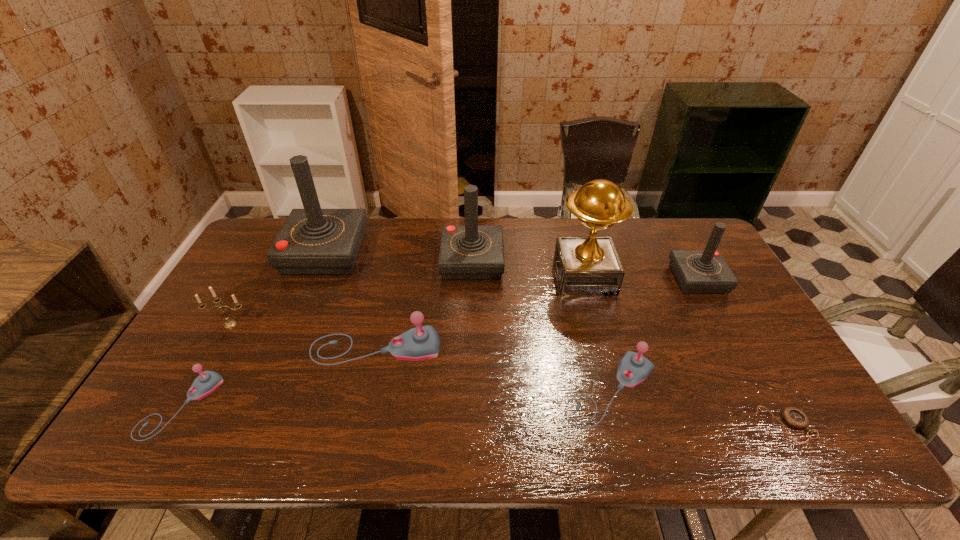
The height and width of the screenshot is (540, 960). I want to click on the second gray joystick from left to right, so click(x=423, y=342).

Find the location of a particular element. the rightmost gray joystick is located at coordinates (633, 368).

Where is `the second joystick from right to left`? The width and height of the screenshot is (960, 540). the second joystick from right to left is located at coordinates pos(633,368).

You are a GUI agent. You are given a task and a screenshot of the screen. Output one action in this format:
    pyautogui.click(x=<x>, y=<y>)
    Task: Click on the shortest joystick
    
    Given the screenshot: What is the action you would take?
    pyautogui.click(x=207, y=381)

Locate an element on the screen. the second shortest object is located at coordinates (207, 381).

The height and width of the screenshot is (540, 960). Identify the location of pocket watch. (795, 417).

Image resolution: width=960 pixels, height=540 pixels. I want to click on free region located 0.150m on the rectangular base of the leftmost red joystick, so click(x=407, y=253).

At what (x,y) coordinates should I click in order to perform the action: click on blank space located on the front-facing side of the gold award. Please return your answer as a coordinate pair (x, y). This screenshot has width=960, height=540. Looking at the image, I should click on (436, 276).

The height and width of the screenshot is (540, 960). In order to click on vacant space located on the front-facing side of the gold award in this screenshot , I will do `click(498, 276)`.

Image resolution: width=960 pixels, height=540 pixels. I want to click on vacant space located on the front-facing side of the gold award, so click(x=511, y=276).